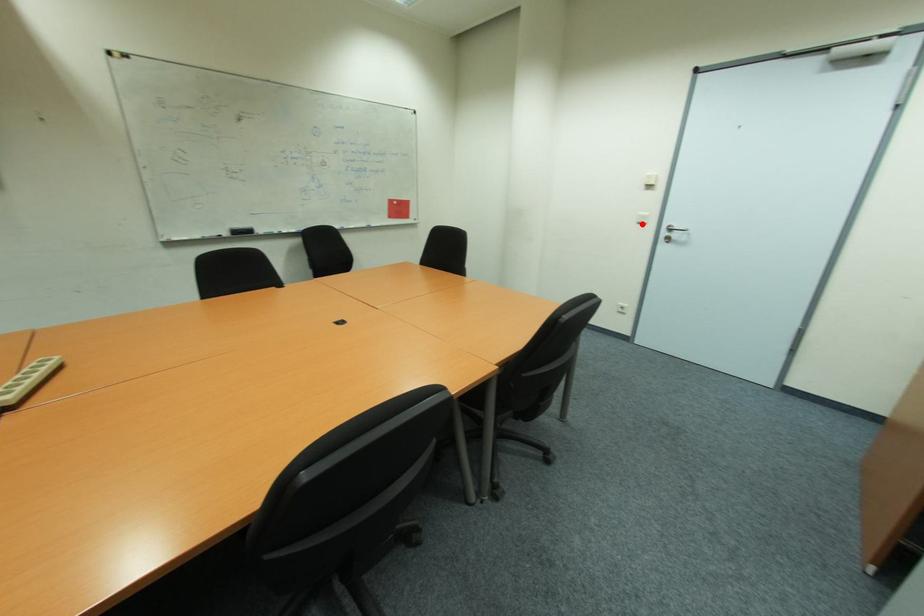
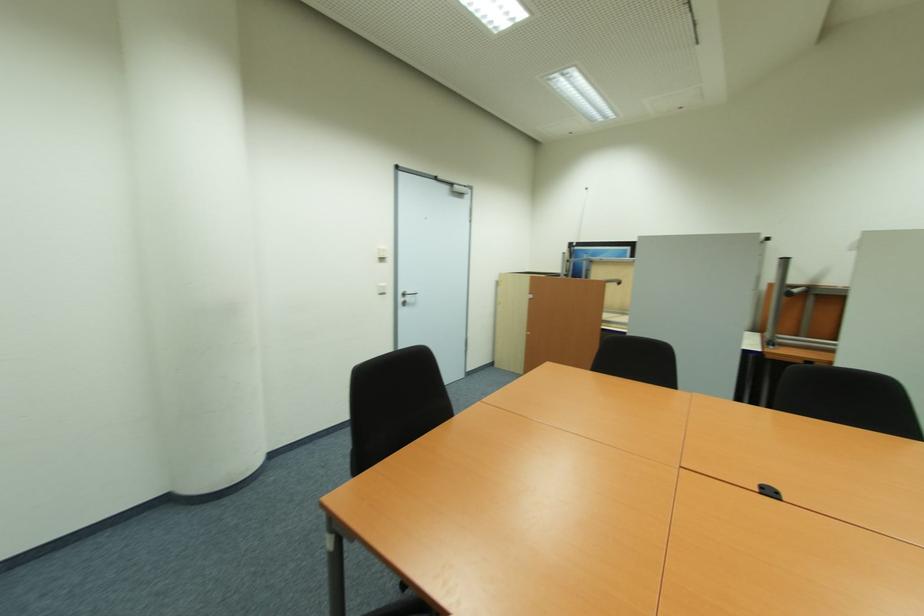
In the second image, find the point that corresponds to the highlighted location in the first image.

(383, 294)